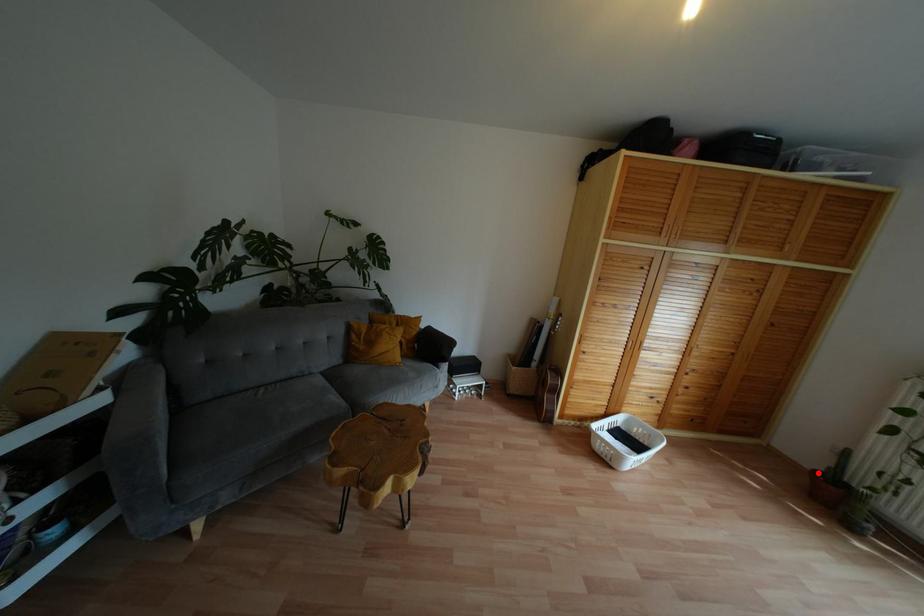
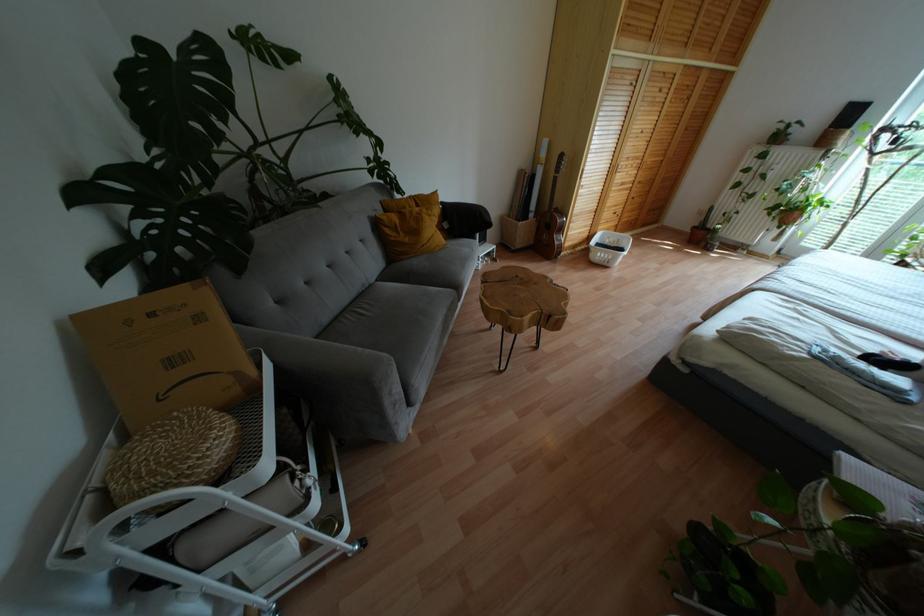
Question: I am providing you with two images of the same scene from different viewpoints. Image1 has a red point marked. In image2, the corresponding 3D location appears at what relative position? Reply with the corresponding letter.

Choices:
 (A) Closer
 (B) Farther

Answer: (A)